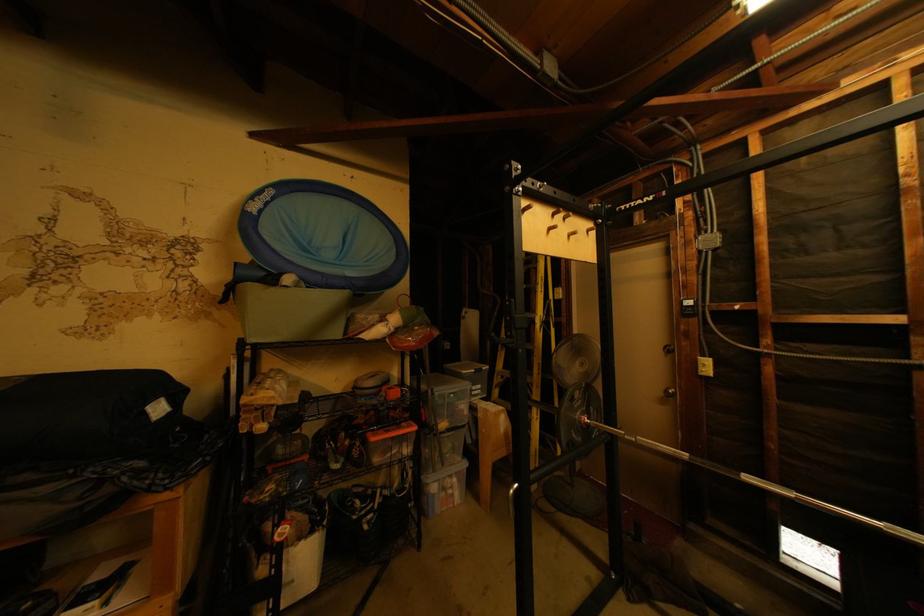
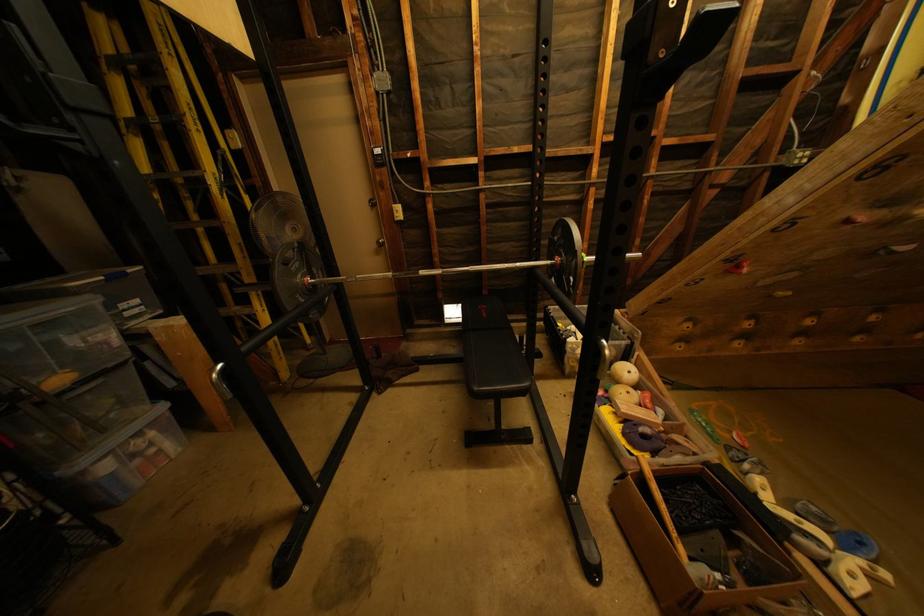
First-person continuous shooting, in which direction is the camera rotating?

A: The camera rotated toward right-down.